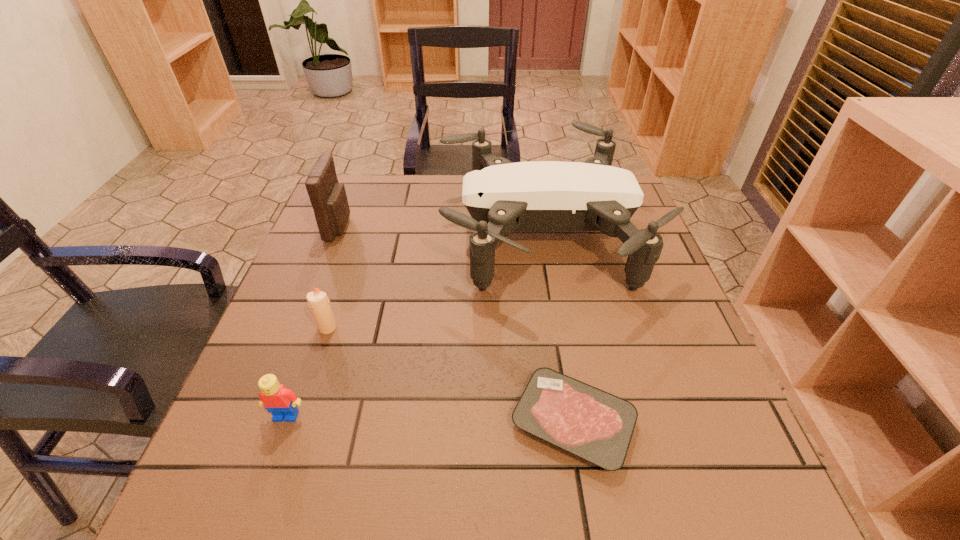
Where is `object that is at the far right corner`? The width and height of the screenshot is (960, 540). object that is at the far right corner is located at coordinates (501, 196).

The image size is (960, 540). Find the location of `vacant space at the far edge`. vacant space at the far edge is located at coordinates (443, 216).

You are a GUI agent. You are given a task and a screenshot of the screen. Output one action in this format:
    pyautogui.click(x=<x>, y=<y>)
    Task: Click on the free location at the near edge
    The width and height of the screenshot is (960, 540).
    Given the screenshot: What is the action you would take?
    pyautogui.click(x=365, y=511)

Identify the location of vacant space at the left edge. (358, 260).

Where is `free space at the right edge of the desktop`? The width and height of the screenshot is (960, 540). free space at the right edge of the desktop is located at coordinates (603, 285).

In the image, there is a desktop. Identify the location of vacant space at the far left corner. Image resolution: width=960 pixels, height=540 pixels. (353, 207).

The image size is (960, 540). I want to click on free region at the near left corner of the desktop, so click(229, 498).

What are the coordinates of `free space that is in between the shortest object and the pouch` in the screenshot? It's located at (456, 324).

This screenshot has height=540, width=960. I want to click on free space that is in between the Lego and the drone, so click(415, 325).

Identify the location of free space between the candle and the pouch. The width and height of the screenshot is (960, 540). (333, 277).